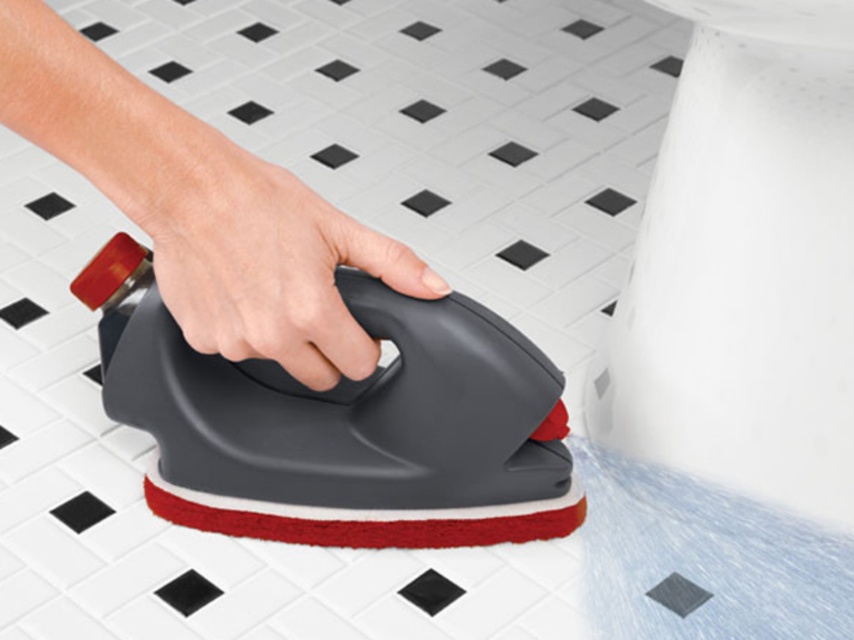
Does matte black scrubber at center come behind gray matte sponge at center?

No, it is not.

Between matte black scrubber at center and gray matte sponge at center, which one has less height?

gray matte sponge at center is shorter.

Locate an element on the screen. The image size is (854, 640). matte black scrubber at center is located at coordinates (202, 208).